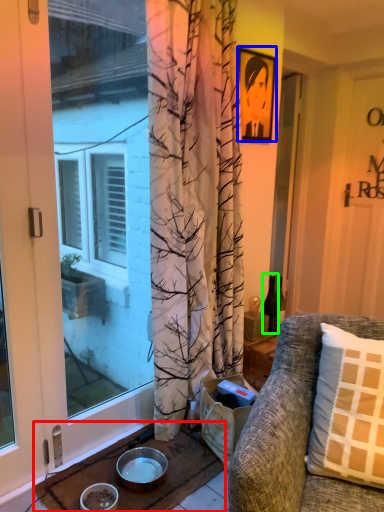
Question: Which object is the closest to the doormat (highlighted by a red box)? Choose among these: picture frame (highlighted by a blue box) or bottle (highlighted by a green box).

Choices:
 (A) picture frame
 (B) bottle

Answer: (B)